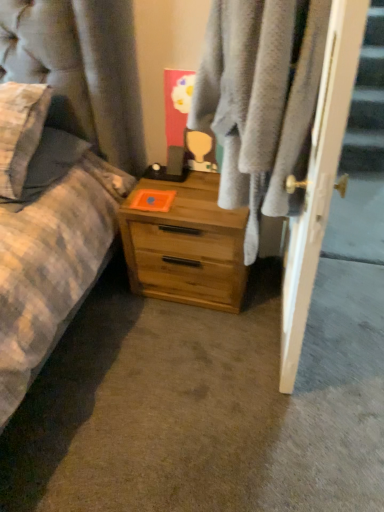
Question: Does light wood chest of drawers at center have a greater height compared to white glossy door at right?

Choices:
 (A) yes
 (B) no

Answer: (B)

Question: Can white glossy door at right be found inside light wood chest of drawers at center?

Choices:
 (A) yes
 (B) no

Answer: (B)

Question: Considering the relative positions of light wood chest of drawers at center and white glossy door at right in the image provided, is light wood chest of drawers at center to the left of white glossy door at right from the viewer's perspective?

Choices:
 (A) yes
 (B) no

Answer: (A)

Question: Is light wood chest of drawers at center in contact with white glossy door at right?

Choices:
 (A) no
 (B) yes

Answer: (A)

Question: Is light wood chest of drawers at center positioned before white glossy door at right?

Choices:
 (A) yes
 (B) no

Answer: (B)

Question: Is light wood chest of drawers at center further to the viewer compared to white glossy door at right?

Choices:
 (A) yes
 (B) no

Answer: (A)

Question: Is white glossy door at right wider than soft gray towel at center?

Choices:
 (A) yes
 (B) no

Answer: (B)

Question: From a real-world perspective, is white glossy door at right below soft gray towel at center?

Choices:
 (A) yes
 (B) no

Answer: (A)

Question: Are white glossy door at right and soft gray towel at center far apart?

Choices:
 (A) yes
 (B) no

Answer: (B)

Question: Considering the relative sizes of white glossy door at right and soft gray towel at center in the image provided, is white glossy door at right shorter than soft gray towel at center?

Choices:
 (A) no
 (B) yes

Answer: (A)

Question: Can you confirm if white glossy door at right is taller than soft gray towel at center?

Choices:
 (A) yes
 (B) no

Answer: (A)

Question: Is white glossy door at right in contact with soft gray towel at center?

Choices:
 (A) yes
 (B) no

Answer: (B)

Question: Considering the relative sizes of soft gray towel at center and light wood chest of drawers at center in the image provided, is soft gray towel at center thinner than light wood chest of drawers at center?

Choices:
 (A) no
 (B) yes

Answer: (B)